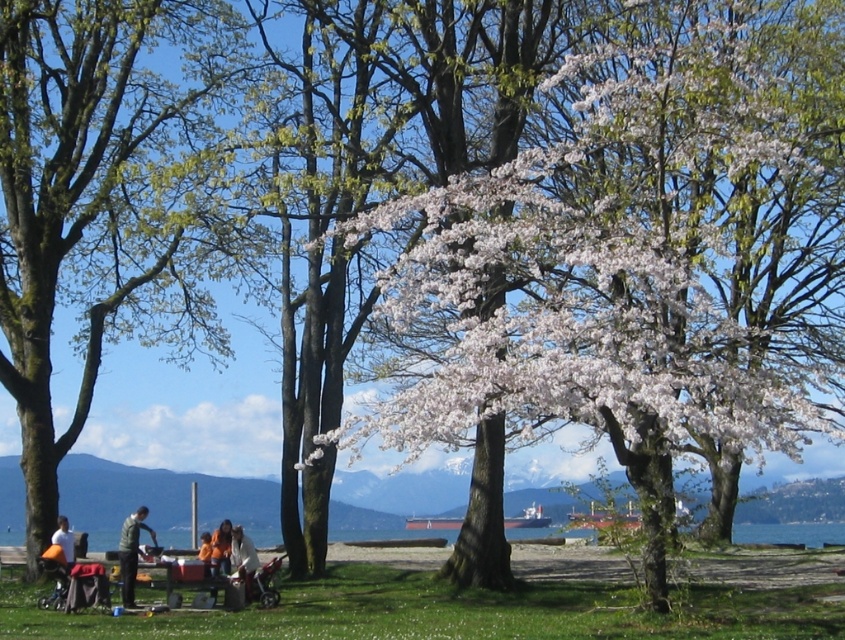
Is white cotton shirt at center shorter than white cotton shirt at lower left?

No, white cotton shirt at center is not shorter than white cotton shirt at lower left.

Who is lower down, white cotton shirt at center or white cotton shirt at lower left?

white cotton shirt at center is lower down.

What do you see at coordinates (244, 561) in the screenshot? I see `white cotton shirt at center` at bounding box center [244, 561].

Identify the location of white cotton shirt at center. Image resolution: width=845 pixels, height=640 pixels. (244, 561).

Who is higher up, smooth green tree at center or green fabric jacket at center?

smooth green tree at center

Is point (195, 4) positioned in front of point (129, 541)?

No, it is behind (129, 541).

Which is behind, point (150, 212) or point (124, 532)?

Positioned behind is point (150, 212).

The width and height of the screenshot is (845, 640). In order to click on smooth green tree at center in this screenshot , I will do `click(108, 198)`.

Which is behind, point (118, 550) or point (213, 536)?

The point (118, 550) is more distant.

Between green fabric jacket at center and orange fabric jacket at lower center, which one appears on the right side from the viewer's perspective?

Positioned to the right is orange fabric jacket at lower center.

The width and height of the screenshot is (845, 640). I want to click on green fabric jacket at center, so click(131, 552).